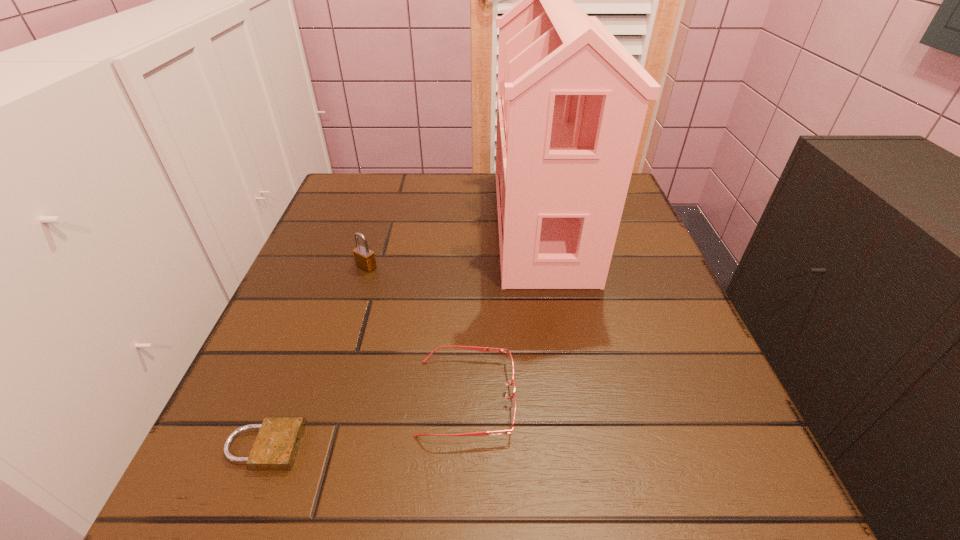
At what (x,y) coordinates should I click in order to perform the action: click on vacant region between the dollhouse and the taller padlock. Please return your answer as a coordinate pair (x, y). Looking at the image, I should click on (454, 245).

Where is `vacant region between the second tallest object and the tallest object`? Image resolution: width=960 pixels, height=540 pixels. vacant region between the second tallest object and the tallest object is located at coordinates (454, 245).

This screenshot has height=540, width=960. I want to click on object that stands as the closest to the tallest object, so click(510, 367).

Identify which object is located as the second nearest to the tallest object. Please provide its 2D coordinates. Your answer should be formatted as a tuple, i.e. [(x, y)], where the tuple contains the x and y coordinates of a point satisfying the conditions above.

[(364, 258)]

The height and width of the screenshot is (540, 960). What are the coordinates of `vacant area in the image that satisfies the following two spatial constraints: 1. on the front side of the farther padlock; 2. on the keyhole side of the nearer padlock` in the screenshot? It's located at (312, 446).